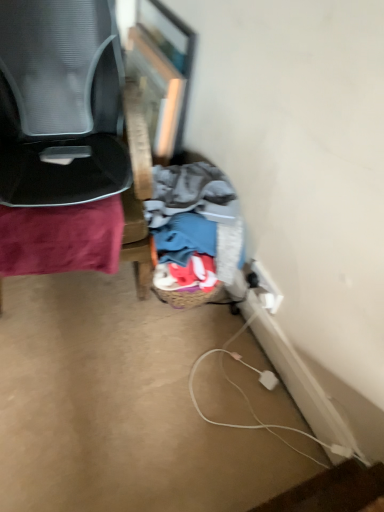
Describe the element at coordinates (267, 288) in the screenshot. I see `white plastic electrical outlet at lower right` at that location.

I want to click on white plastic electrical outlet at lower right, so click(x=267, y=288).

What is the approximate width of white plastic electrical outlet at lower right?

white plastic electrical outlet at lower right is 2.27 centimeters in width.

Locate an element on the screen. white plastic electrical outlet at lower right is located at coordinates (267, 288).